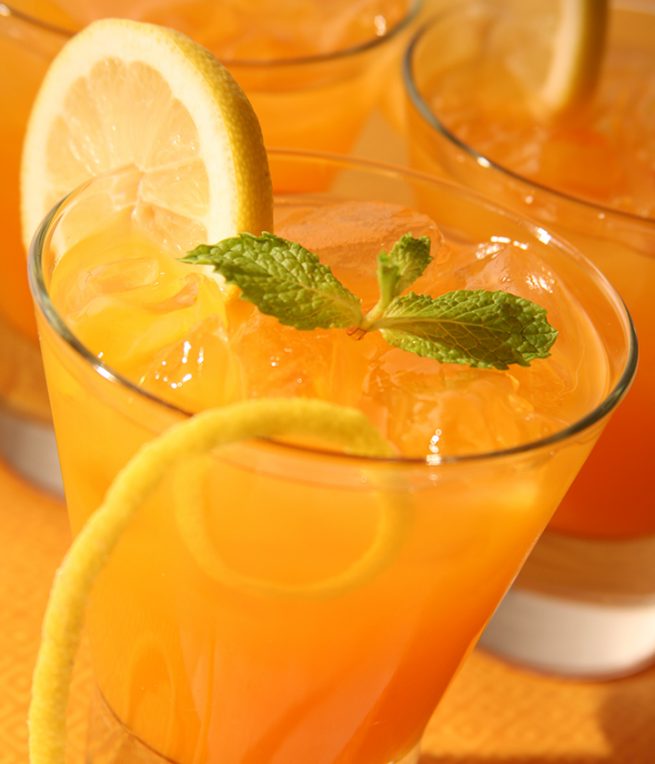
The image size is (655, 764). I want to click on glass, so click(x=612, y=225).